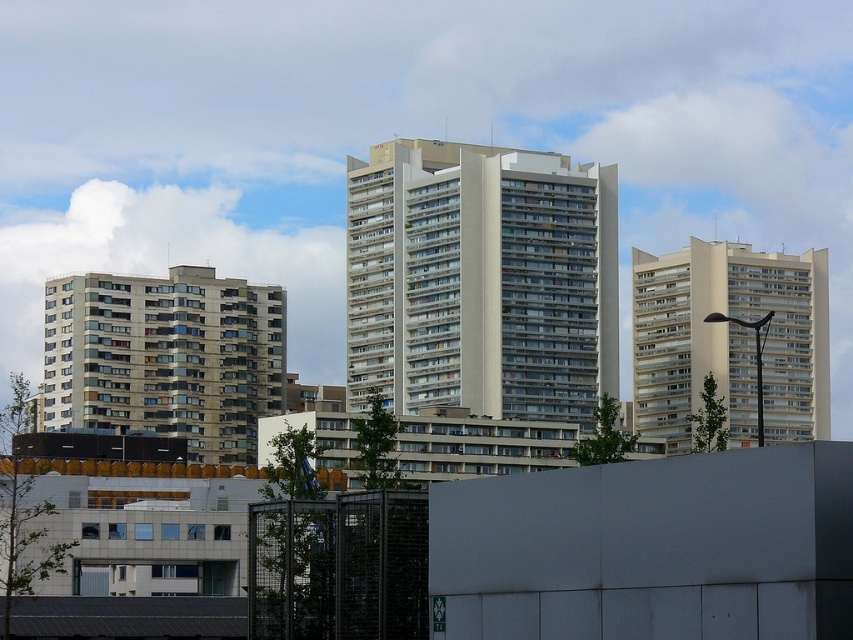
You are standing at the point marked by the coordinate point at (480, 280) in the cityscape image. Which building are you facing? Please provide the exact object label from the scene description.

The point at (480, 280) marks the white smooth building at center, so you are facing the white smooth building at center.